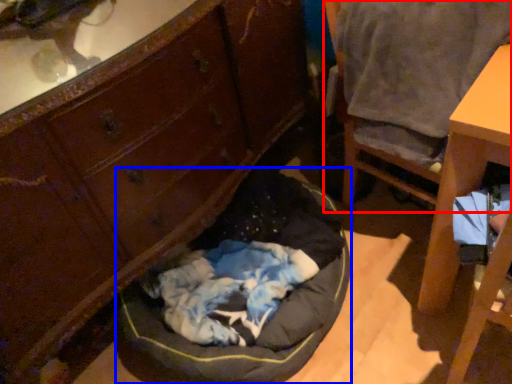
Question: Among these objects, which one is farthest to the camera, chair (highlighted by a red box) or dog bed (highlighted by a blue box)?

Choices:
 (A) chair
 (B) dog bed

Answer: (B)